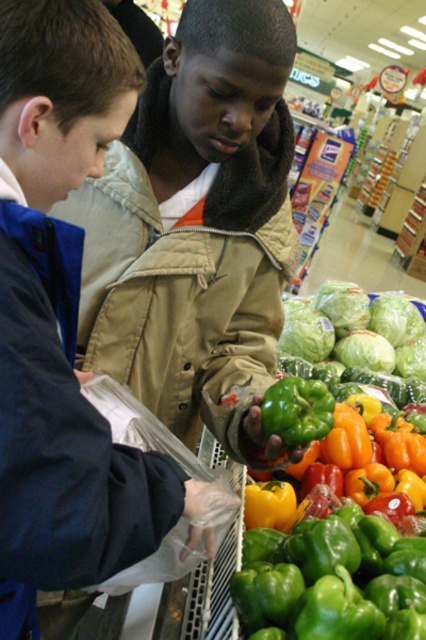
Is point (201, 253) farther from viewer compared to point (250, 580)?

Yes, point (201, 253) is farther from viewer.

Based on the photo, can you confirm if matte khaki jacket at center is bigger than green matte bell pepper at center?

Actually, matte khaki jacket at center might be smaller than green matte bell pepper at center.

What do you see at coordinates (196, 228) in the screenshot?
I see `matte khaki jacket at center` at bounding box center [196, 228].

Locate an element on the screen. The width and height of the screenshot is (426, 640). matte khaki jacket at center is located at coordinates (196, 228).

Is matte khaki jacket at center to the left of matte black jacket at left from the viewer's perspective?

No, matte khaki jacket at center is not to the left of matte black jacket at left.

Between matte khaki jacket at center and matte black jacket at left, which one appears on the left side from the viewer's perspective?

Positioned to the left is matte black jacket at left.

Who is more forward, [206,340] or [186,499]?

Point [186,499] is in front.

You are a GUI agent. You are given a task and a screenshot of the screen. Output one action in this format:
    pyautogui.click(x=<x>, y=<y>)
    Task: Click on the matte khaki jacket at center
    This screenshot has width=426, height=640.
    Given the screenshot: What is the action you would take?
    pyautogui.click(x=196, y=228)

Which is in front, point (115, 556) or point (357, 630)?

Point (115, 556) is more forward.

Who is higher up, matte black jacket at left or green matte bell pepper at center?

matte black jacket at left is higher up.

The image size is (426, 640). I want to click on matte black jacket at left, so click(62, 317).